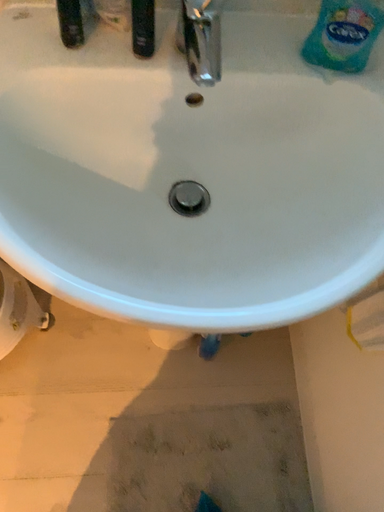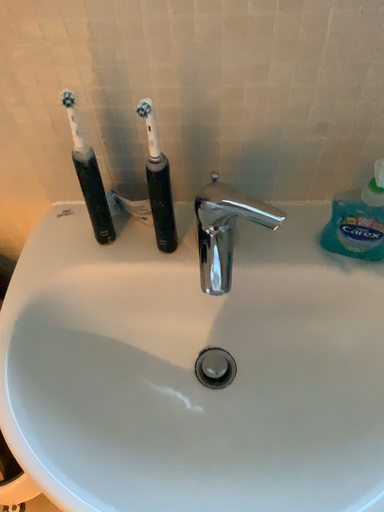
Question: Which way did the camera rotate in the video?

Choices:
 (A) rotated right
 (B) rotated left

Answer: (B)